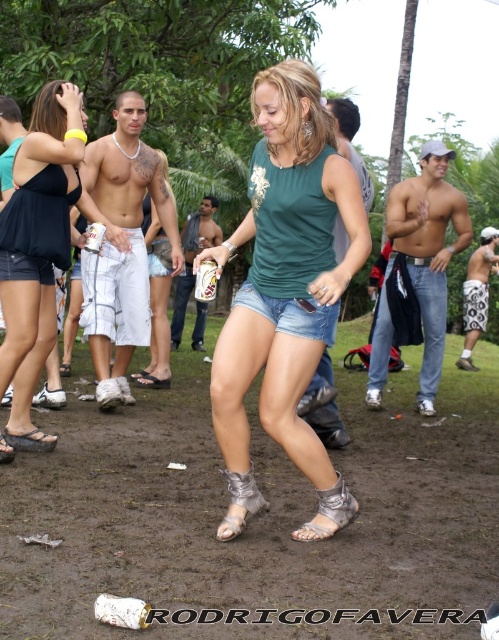
Question: Can you confirm if green matte tank top at center is positioned below white cotton shorts at center?

Choices:
 (A) no
 (B) yes

Answer: (B)

Question: Which of the following is the closest to the observer?

Choices:
 (A) shiny silver shorts at center
 (B) metallic silver can at center
 (C) matte black tank top at upper left
 (D) matte white shorts at center

Answer: (C)

Question: Is white cotton shorts at center smaller than shiny silver shorts at center?

Choices:
 (A) yes
 (B) no

Answer: (B)

Question: Which point is closer to the camera?

Choices:
 (A) (122, 228)
 (B) (167, 346)
 (C) (200, 227)

Answer: (A)

Question: Does metallic silver can at center appear on the right side of white patterned shorts at right?

Choices:
 (A) no
 (B) yes

Answer: (A)

Question: Which point is closer to the camera?

Choices:
 (A) white patterned shorts at right
 (B) white cotton shorts at center
 (C) muscular skin torso at center

Answer: (B)